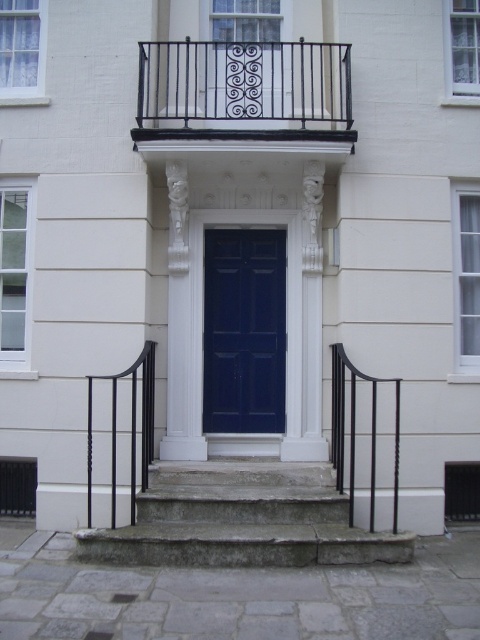
Question: Can you confirm if black wrought iron balcony at upper center is positioned above matte blue door at center?

Choices:
 (A) no
 (B) yes

Answer: (B)

Question: Among these objects, which one is nearest to the camera?

Choices:
 (A) stone steps at center
 (B) black wrought iron railing at right

Answer: (A)

Question: Which object is closer to the camera taking this photo?

Choices:
 (A) black wrought iron railing at right
 (B) black wrought iron balcony at upper center
 (C) stone steps at center

Answer: (C)

Question: Can you confirm if black wrought iron balcony at upper center is wider than matte blue door at center?

Choices:
 (A) yes
 (B) no

Answer: (A)

Question: Is black wrought iron balcony at upper center wider than black wrought iron railing at lower left?

Choices:
 (A) no
 (B) yes

Answer: (B)

Question: Which point appears closest to the camera in this image?

Choices:
 (A) (113, 484)
 (B) (236, 477)
 (C) (352, 493)

Answer: (C)